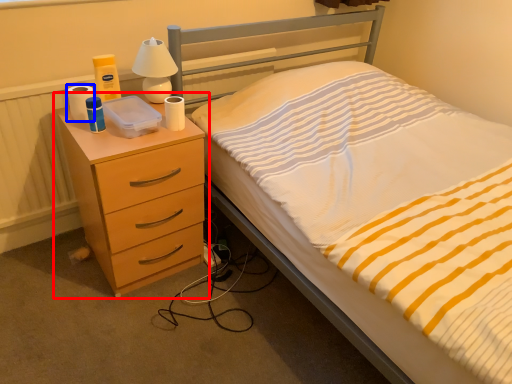
Question: Which object appears farthest to the camera in this image, chest of drawers (highlighted by a red box) or toilet paper (highlighted by a blue box)?

Choices:
 (A) chest of drawers
 (B) toilet paper

Answer: (B)